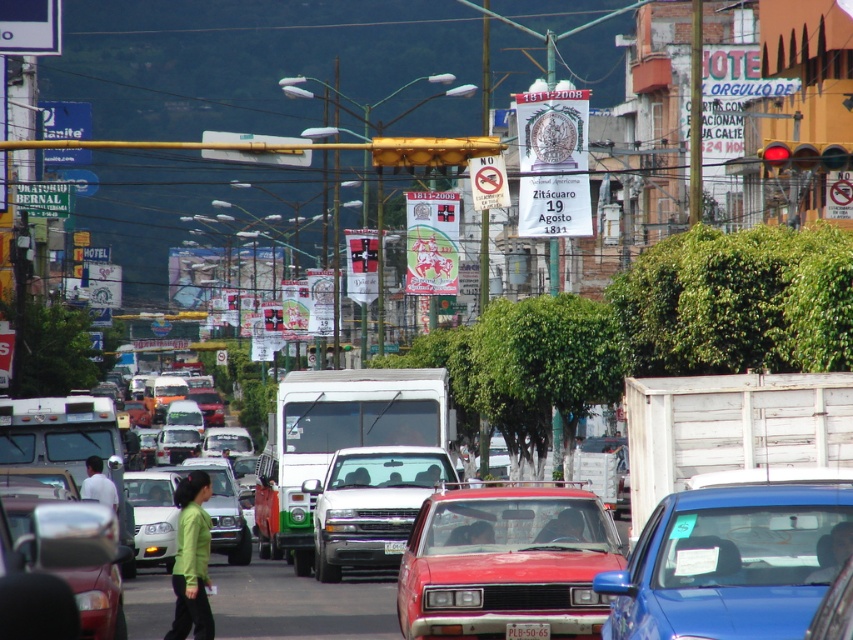
Question: Does shiny red sedan at center appear on the left side of shiny silver sedan at center?

Choices:
 (A) no
 (B) yes

Answer: (A)

Question: Is the position of yellow plastic license plate at center less distant than that of white plastic license plate at center?

Choices:
 (A) no
 (B) yes

Answer: (B)

Question: Does shiny red sedan at center appear on the left side of white matte shirt at center?

Choices:
 (A) yes
 (B) no

Answer: (B)

Question: Which is farther from the shiny red sedan at center?

Choices:
 (A) green matte jacket at lower left
 (B) white plastic license plate at center

Answer: (B)

Question: Which point is farther to the camera?

Choices:
 (A) yellow plastic license plate at center
 (B) green matte shirt at center
 (C) shiny red sedan at center
 (D) shiny silver sedan at center

Answer: (B)

Question: Among these objects, which one is nearest to the camera?

Choices:
 (A) shiny red sedan at center
 (B) white matte shirt at center
 (C) shiny silver sedan at center

Answer: (C)